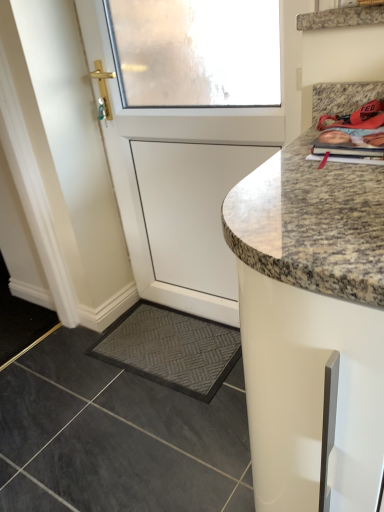
What is the approximate width of matte orange magazine at upper right?

23.74 centimeters.

At what (x,y) coordinates should I click in order to perform the action: click on white matte door at upper left. Please return your answer as a coordinate pair (x, y). Image resolution: width=384 pixels, height=512 pixels. Looking at the image, I should click on (199, 143).

This screenshot has height=512, width=384. Describe the element at coordinates (171, 349) in the screenshot. I see `dark gray textured mat at lower left` at that location.

Locate an element on the screen. The image size is (384, 512). granite shelf at upper right is located at coordinates (341, 17).

Locate an element on the screen. granite at lower right is located at coordinates (116, 437).

Locate an element on the screen. matte orange magazine at upper right is located at coordinates (349, 146).

From the image's perspective, is granite at lower right above granite shelf at upper right?

Actually, granite at lower right appears below granite shelf at upper right in the image.

Is the depth of granite at lower right less than that of granite shelf at upper right?

No, the depth of granite at lower right is greater than that of granite shelf at upper right.

Considering the positions of point (366, 13) and point (133, 126), is point (366, 13) closer or farther from the camera than point (133, 126)?

Clearly, point (366, 13) is closer to the camera than point (133, 126).

Is granite shelf at upper right outside of white matte door at upper left?

Yes, granite shelf at upper right is located beyond the bounds of white matte door at upper left.

Does granite shelf at upper right have a smaller size compared to white matte door at upper left?

Correct, granite shelf at upper right occupies less space than white matte door at upper left.

Is granite shelf at upper right taller or shorter than white matte door at upper left?

In the image, granite shelf at upper right appears to be shorter than white matte door at upper left.

Is white matte door at upper left oriented towards matte orange magazine at upper right?

No, white matte door at upper left is not aimed at matte orange magazine at upper right.

Does white matte door at upper left have a smaller size compared to matte orange magazine at upper right?

Actually, white matte door at upper left might be larger than matte orange magazine at upper right.

How different are the orientations of white matte door at upper left and matte orange magazine at upper right in degrees?

The facing directions of white matte door at upper left and matte orange magazine at upper right are 0.228 degrees apart.

Between white matte door at upper left and matte orange magazine at upper right, which one has larger width?

matte orange magazine at upper right.

Can you confirm if granite at lower right is bigger than matte orange magazine at upper right?

Indeed, granite at lower right has a larger size compared to matte orange magazine at upper right.

Is point (107, 389) closer or farther from the camera than point (351, 133)?

Point (107, 389) is farther from the camera than point (351, 133).

From the image's perspective, between granite at lower right and matte orange magazine at upper right, which one is located above?

matte orange magazine at upper right.

Can you confirm if granite at lower right is shorter than matte orange magazine at upper right?

No.

Considering the positions of points (150, 266) and (135, 426), is point (150, 266) farther from camera compared to point (135, 426)?

Yes, point (150, 266) is behind point (135, 426).

From the image's perspective, is white matte door at upper left located above granite at lower right?

Yes, from the image's perspective, white matte door at upper left is above granite at lower right.

Where is `granite in front of the white matte door at upper left`? The height and width of the screenshot is (512, 384). granite in front of the white matte door at upper left is located at coordinates (116, 437).

Is white matte door at upper left looking in the opposite direction of granite at lower right?

That's not correct — white matte door at upper left is not looking away from granite at lower right.

Can you tell me how much matte orange magazine at upper right and granite at lower right differ in facing direction?

90.7 degrees.

Is matte orange magazine at upper right not within granite at lower right?

Yes, matte orange magazine at upper right is not within granite at lower right.

Is matte orange magazine at upper right closer to camera compared to granite at lower right?

Yes, matte orange magazine at upper right is in front of granite at lower right.

Considering the points (351, 158) and (15, 500), which point is behind, point (351, 158) or point (15, 500)?

Point (15, 500)

You are a GUI agent. You are given a task and a screenshot of the screen. Output one action in this format:
    pyautogui.click(x=<x>, y=<y>)
    Task: Click on the door that appears on the right of granite at lower right
    Image resolution: width=384 pixels, height=512 pixels.
    Given the screenshot: What is the action you would take?
    pyautogui.click(x=199, y=143)

Considering the positions of points (115, 489) and (152, 271), is point (115, 489) farther from camera compared to point (152, 271)?

No, (115, 489) is in front of (152, 271).

From a real-world perspective, is granite at lower right beneath white matte door at upper left?

Yes, from a real-world perspective, granite at lower right is beneath white matte door at upper left.

From the picture: From the image's perspective, would you say granite at lower right is shown under white matte door at upper left?

Yes, from the image's perspective, granite at lower right is below white matte door at upper left.

Locate an element on the screen. Image resolution: width=384 pixels, height=512 pixels. shelf located on the right of granite at lower right is located at coordinates (341, 17).

I want to click on door behind the granite shelf at upper right, so click(x=199, y=143).

Which object lies further to the anchor point matte orange magazine at upper right, granite at lower right or white matte door at upper left?

granite at lower right lies further to matte orange magazine at upper right than the other object.

When comparing their distances from dark gray textured mat at lower left, does white matte door at upper left or granite at lower right seem closer?

Among the two, granite at lower right is located nearer to dark gray textured mat at lower left.

From the picture: Estimate the real-world distances between objects in this image. Which object is closer to granite at lower right, granite shelf at upper right or dark gray textured mat at lower left?

→ dark gray textured mat at lower left is positioned closer to the anchor granite at lower right.

Estimate the real-world distances between objects in this image. Which object is further from white matte door at upper left, granite at lower right or dark gray textured mat at lower left?

Among the two, granite at lower right is located further to white matte door at upper left.

When comparing their distances from granite shelf at upper right, does white matte door at upper left or matte orange magazine at upper right seem closer?

matte orange magazine at upper right is positioned closer to the anchor granite shelf at upper right.

Based on their spatial positions, is matte orange magazine at upper right or granite shelf at upper right further from white matte door at upper left?

Among the two, matte orange magazine at upper right is located further to white matte door at upper left.

When comparing their distances from granite at lower right, does matte orange magazine at upper right or dark gray textured mat at lower left seem further?

matte orange magazine at upper right is positioned further to the anchor granite at lower right.

From the picture: Looking at the image, which one is located further to white matte door at upper left, dark gray textured mat at lower left or granite at lower right?

Among the two, granite at lower right is located further to white matte door at upper left.

Locate an element on the screen. This screenshot has height=512, width=384. door between granite shelf at upper right and granite at lower right from top to bottom is located at coordinates (199, 143).

The height and width of the screenshot is (512, 384). I want to click on magazine situated between white matte door at upper left and granite shelf at upper right from left to right, so click(x=349, y=146).

Locate an element on the screen. magazine between granite shelf at upper right and granite at lower right from top to bottom is located at coordinates (349, 146).

This screenshot has width=384, height=512. I want to click on slate between matte orange magazine at upper right and granite at lower right in the up-down direction, so click(x=171, y=349).